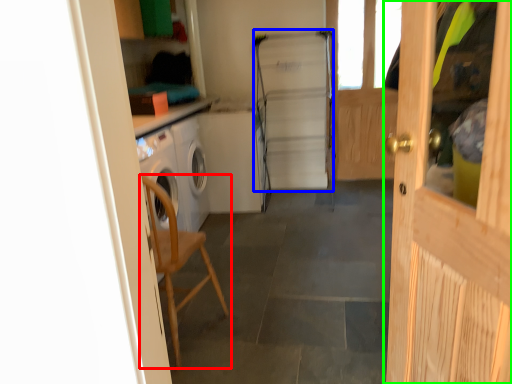
Question: Which object is the closest to the chair (highlighted by a red box)? Choose among these: fridge (highlighted by a blue box) or door (highlighted by a green box).

Choices:
 (A) fridge
 (B) door

Answer: (B)